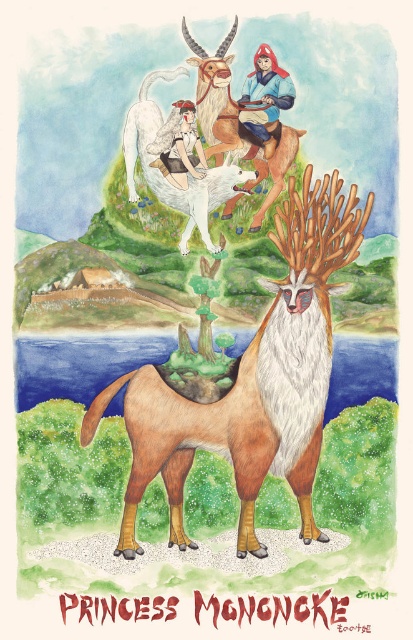
You are an artist who wants to draw the scene shown in the image. You need to ensure that the smooth brown deer at upper center and the matte white santa claus at upper center are spaced exactly 25.78 inches apart. How far apart should you draw them on your canvas?

You should draw the smooth brown deer at upper center and the matte white santa claus at upper center exactly 25.78 inches apart from each other as stated in the description.